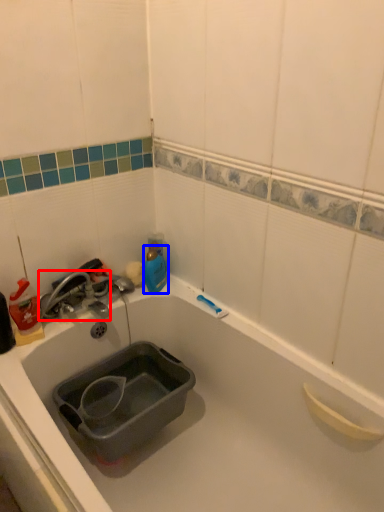
Question: Which object appears closest to the camera in this image, tap (highlighted by a red box) or bottle (highlighted by a blue box)?

Choices:
 (A) tap
 (B) bottle

Answer: (A)